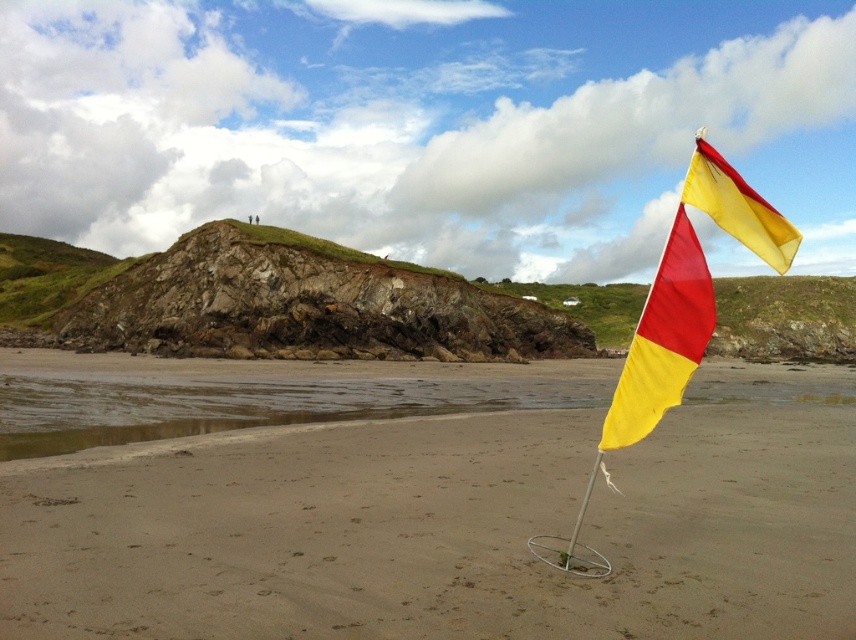
Question: Among these objects, which one is nearest to the camera?

Choices:
 (A) yellow fabric flag at right
 (B) yellow fabric flag at center

Answer: (B)

Question: Which point appears farthest from the camera in this image?

Choices:
 (A) (682, 616)
 (B) (703, 164)

Answer: (B)

Question: Can you confirm if yellow fabric flag at center is wider than yellow fabric flag at right?

Choices:
 (A) yes
 (B) no

Answer: (A)

Question: Does yellow fabric flag at center come in front of yellow fabric flag at right?

Choices:
 (A) no
 (B) yes

Answer: (B)

Question: Is yellow fabric flag at center thinner than yellow fabric flag at right?

Choices:
 (A) no
 (B) yes

Answer: (A)